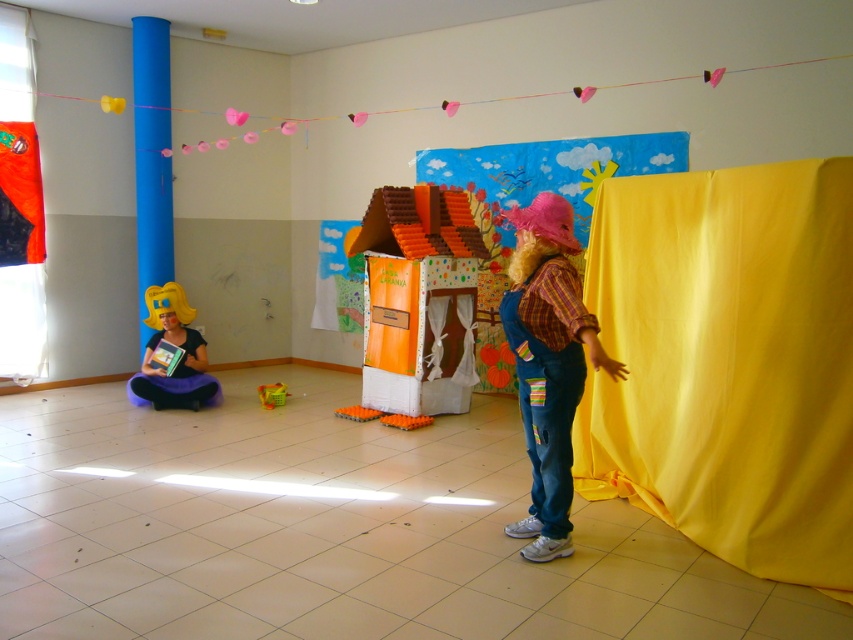
In the scene shown: You are setting up a small stage for a school play. You have an orange cardboard house at center and orange foam blocks at center. Which object should you place first to ensure proper setup?

The orange foam blocks at center should be placed first because the orange cardboard house at center is above them, so they need to be in position to support the house.

You are setting up a stage for a play in the classroom. You have a blue glossy column at left and a matte yellow wig at left. Which object is narrower?

The blue glossy column at left is narrower than the matte yellow wig at left.

You are standing in the classroom and want to move from point A to point B. Point A is at coordinate point (x=155, y=269) and point B is at coordinate point (x=149, y=289). Which point is closer to you?

Point A at coordinate point (x=155, y=269) is closer to you than point B at coordinate point (x=149, y=289) because it is further to the viewer.